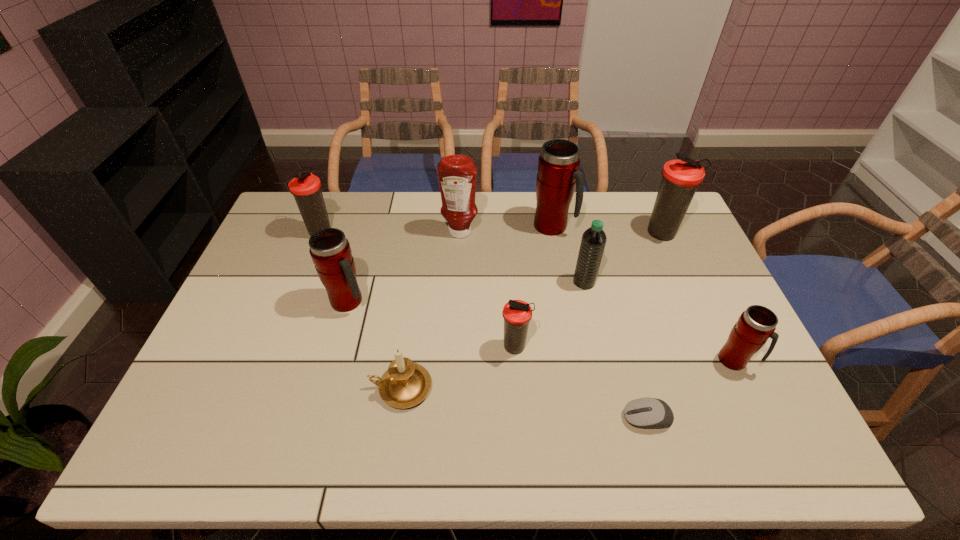
Identify the location of free space between the shortest object and the rightmost brown thermos bottle. The width and height of the screenshot is (960, 540). (x=655, y=326).

Find the location of a particular element. free spot between the biggest brown thermos bottle and the shortest object is located at coordinates (655, 326).

This screenshot has width=960, height=540. I want to click on unoccupied position between the second smallest red thermos bottle and the third thermos bottle from left to right, so click(x=432, y=325).

You are a GUI agent. You are given a task and a screenshot of the screen. Output one action in this format:
    pyautogui.click(x=<x>, y=<y>)
    Task: Click on the empty location between the smallest red thermos bottle and the leftmost object
    The height and width of the screenshot is (540, 960).
    Given the screenshot: What is the action you would take?
    pyautogui.click(x=528, y=296)

Find the location of a particular element. The height and width of the screenshot is (540, 960). blank region between the smallest brown thermos bottle and the smallest red thermos bottle is located at coordinates (625, 354).

Locate an element on the screen. vacant point located between the nearest red thermos bottle and the fourth farthest thermos bottle is located at coordinates (541, 331).

This screenshot has height=540, width=960. I want to click on free spot between the candle holder and the nearest red thermos bottle, so click(567, 374).

You are a GUI agent. You are given a task and a screenshot of the screen. Output one action in this format:
    pyautogui.click(x=<x>, y=<y>)
    Task: Click on the vacant space that is in between the second biggest brown thermos bottle and the third thermos bottle from right to left
    The width and height of the screenshot is (960, 540).
    Given the screenshot: What is the action you would take?
    pyautogui.click(x=438, y=229)

At what (x,y) coordinates should I click in order to perform the action: click on object that ranks as the eighth closest to the black water bottle. Please return your answer as a coordinate pair (x, y). The width and height of the screenshot is (960, 540). Looking at the image, I should click on pyautogui.click(x=330, y=251).

This screenshot has width=960, height=540. In order to click on the sixth closest object to the condiment in this screenshot , I will do `click(405, 384)`.